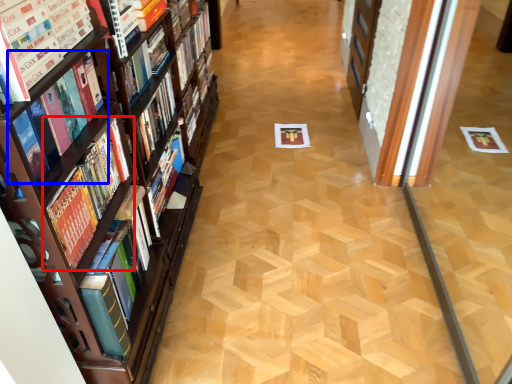
Question: Which point is further to the camera, book (highlighted by a red box) or book (highlighted by a blue box)?

Choices:
 (A) book
 (B) book

Answer: (A)